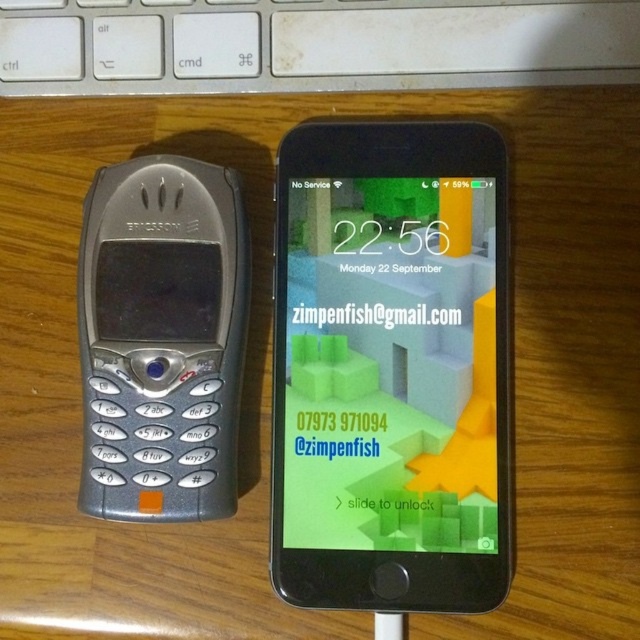
Is matte black smartphone at center thinner than silver metallic phone at left?

No.

Can you confirm if matte black smartphone at center is wider than silver metallic phone at left?

Correct, the width of matte black smartphone at center exceeds that of silver metallic phone at left.

Where is `matte black smartphone at center`? The image size is (640, 640). matte black smartphone at center is located at coordinates (392, 369).

Between white plastic keyboard at upper center and silver metallic phone at left, which one has less height?

white plastic keyboard at upper center is shorter.

Which is in front, point (419, 36) or point (218, 444)?

Positioned in front is point (218, 444).

What are the coordinates of `white plastic keyboard at upper center` in the screenshot? It's located at (310, 44).

Can you confirm if matte black smartphone at center is smaller than white plastic keyboard at upper center?

Incorrect, matte black smartphone at center is not smaller in size than white plastic keyboard at upper center.

Measure the distance between point (422, 346) and camera.

Point (422, 346) and camera are 35.38 inches apart from each other.

This screenshot has width=640, height=640. Find the location of `matte black smartphone at center`. matte black smartphone at center is located at coordinates (392, 369).